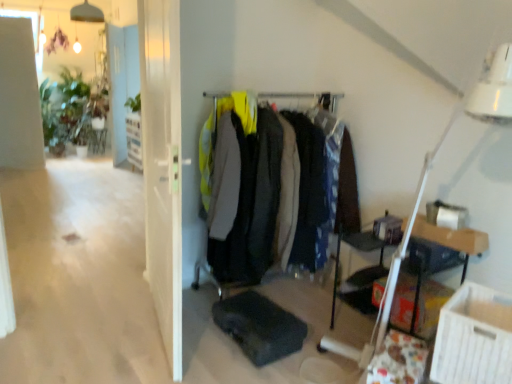
Image resolution: width=512 pixels, height=384 pixels. What are the coordinates of `free space in front of white glossy shelf at upper center` in the screenshot? It's located at (125, 174).